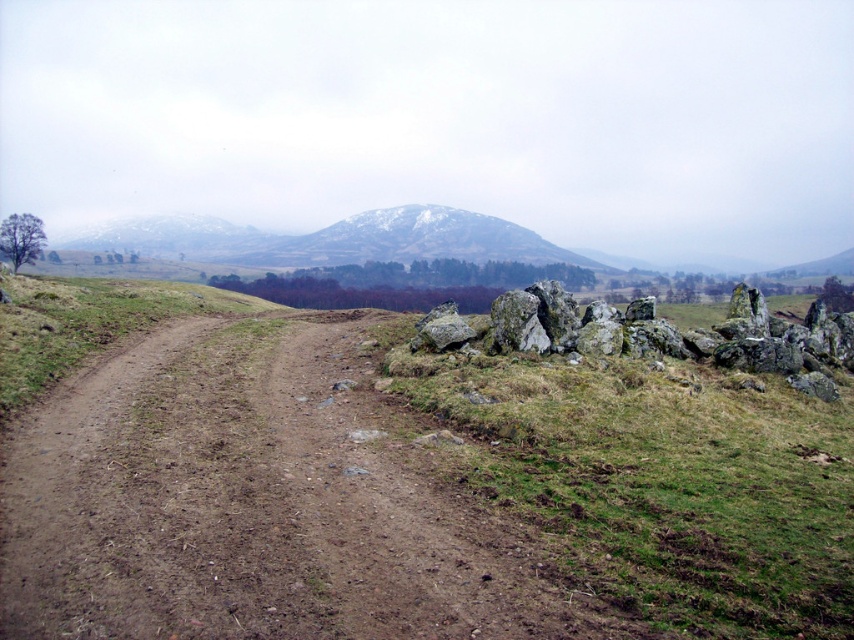
Between green grassy at right and rough textured rocks at right, which one appears on the right side from the viewer's perspective?

rough textured rocks at right

This screenshot has width=854, height=640. Describe the element at coordinates (662, 481) in the screenshot. I see `green grassy at right` at that location.

Is point (468, 460) in front of point (703, 332)?

Yes, point (468, 460) is closer to viewer.

Locate an element on the screen. The width and height of the screenshot is (854, 640). green grassy at right is located at coordinates (662, 481).

Which is more to the left, brown dirt track at center or rough textured rocks at right?

Positioned to the left is brown dirt track at center.

Who is taller, brown dirt track at center or rough textured rocks at right?

rough textured rocks at right

I want to click on brown dirt track at center, so click(x=256, y=504).

Can you confirm if brown dirt track at center is smaller than green grassy at right?

Yes.

Between brown dirt track at center and green grassy at right, which one is positioned higher?

green grassy at right

Which is in front, point (490, 577) or point (652, 614)?

Point (652, 614) is in front.

Where is `brown dirt track at center`? This screenshot has height=640, width=854. brown dirt track at center is located at coordinates (256, 504).